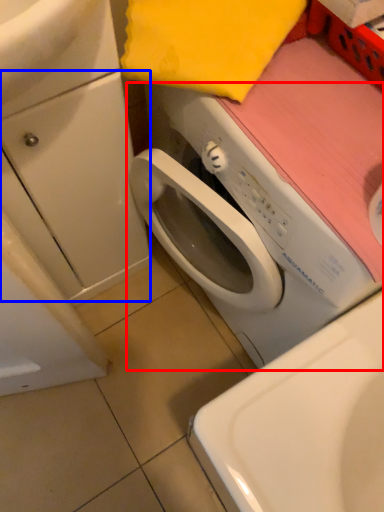
Question: Which object appears closest to the camera in this image, washing machine (highlighted by a red box) or drawer (highlighted by a blue box)?

Choices:
 (A) washing machine
 (B) drawer

Answer: (A)